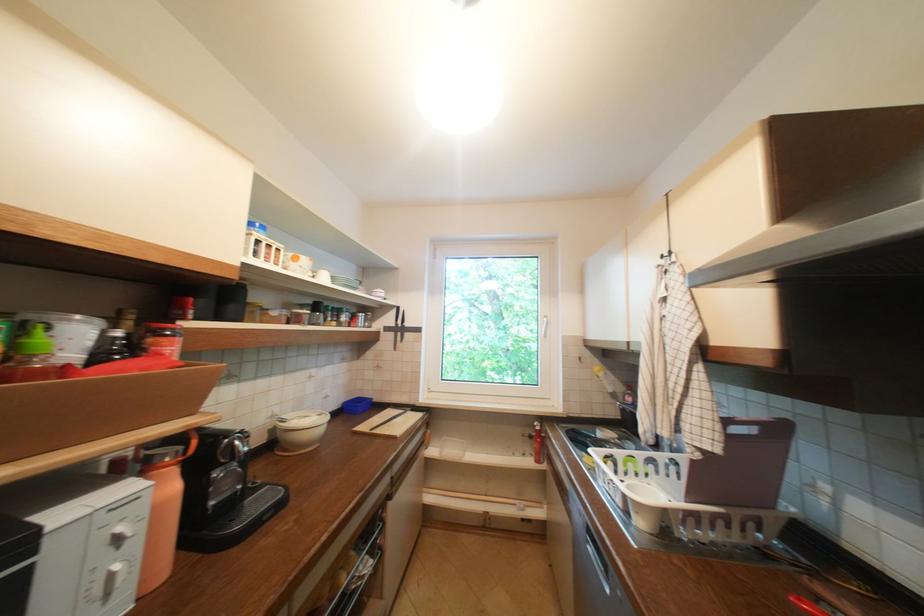
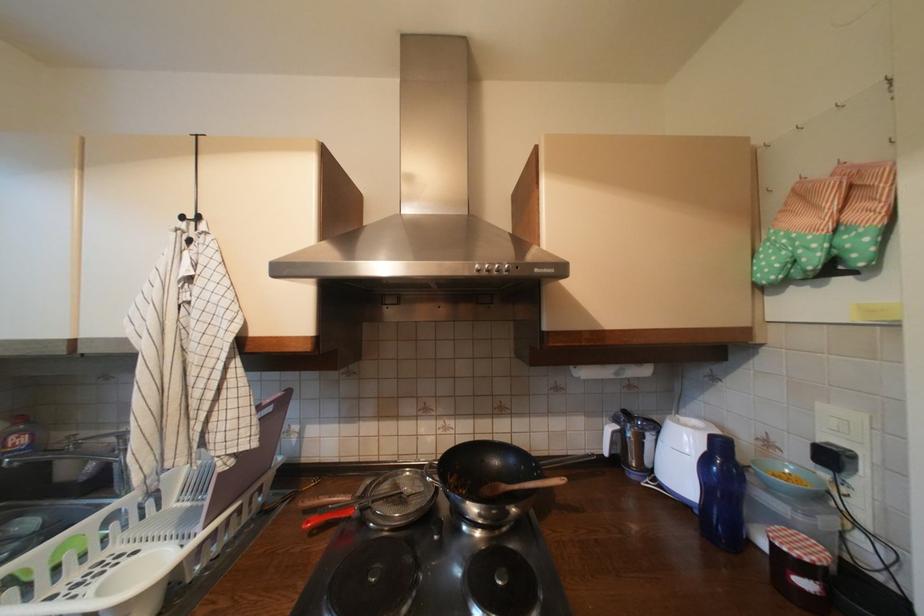
Question: The camera is either moving clockwise (left) or counter-clockwise (right) around the object. The first image is from the beginning of the video and the second image is from the end. Is the camera moving left or right when shooting the video?

Choices:
 (A) Left
 (B) Right

Answer: (A)